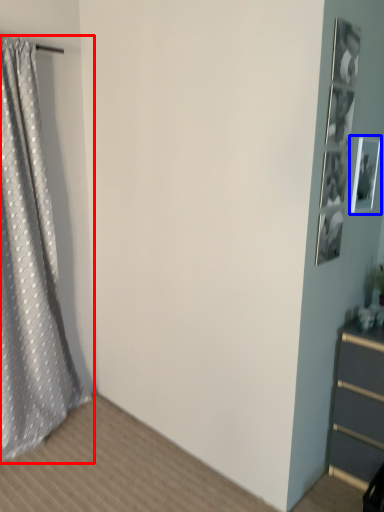
Question: Which of the following is the farthest to the observer, curtain (highlighted by a red box) or picture frame (highlighted by a blue box)?

Choices:
 (A) curtain
 (B) picture frame

Answer: (B)